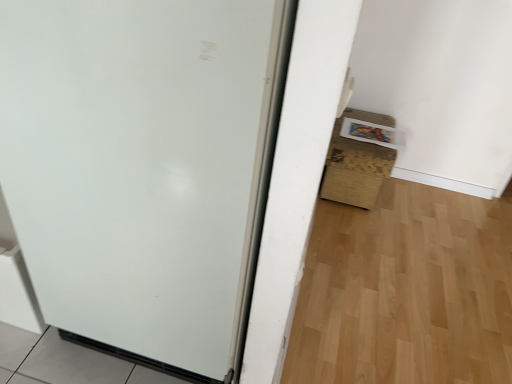
Locate an element on the screen. Image resolution: width=512 pixels, height=384 pixels. white matte door at center is located at coordinates (143, 168).

Describe the element at coordinates (143, 168) in the screenshot. Image resolution: width=512 pixels, height=384 pixels. I see `white matte door at center` at that location.

Image resolution: width=512 pixels, height=384 pixels. Describe the element at coordinates (356, 164) in the screenshot. I see `brown cardboard box at lower right` at that location.

What are the coordinates of `brown cardboard box at lower right` in the screenshot? It's located at (356, 164).

At what (x,y) coordinates should I click in order to perform the action: click on white matte door at center. Please return your answer as a coordinate pair (x, y). The image size is (512, 384). Looking at the image, I should click on (143, 168).

Which object is positioned more to the right, brown cardboard box at lower right or white matte door at center?

brown cardboard box at lower right is more to the right.

Does brown cardboard box at lower right lie behind white matte door at center?

Yes, brown cardboard box at lower right is further from the camera.

Is point (343, 189) less distant than point (156, 117)?

That is False.

From the image's perspective, is brown cardboard box at lower right over white matte door at center?

Yes, from the image's perspective, brown cardboard box at lower right is on top of white matte door at center.

From a real-world perspective, who is located lower, brown cardboard box at lower right or white matte door at center?

brown cardboard box at lower right.

Consider the image. Does brown cardboard box at lower right have a greater width compared to white matte door at center?

No, brown cardboard box at lower right is not wider than white matte door at center.

Does brown cardboard box at lower right have a greater height compared to white matte door at center?

No, brown cardboard box at lower right is not taller than white matte door at center.

Looking at the image, does brown cardboard box at lower right seem bigger or smaller compared to white matte door at center?

Considering their sizes, brown cardboard box at lower right takes up less space than white matte door at center.

From the picture: Can we say brown cardboard box at lower right lies outside white matte door at center?

That's correct, brown cardboard box at lower right is outside of white matte door at center.

Are brown cardboard box at lower right and white matte door at center far apart?

Yes, brown cardboard box at lower right is far from white matte door at center.

Is brown cardboard box at lower right oriented away from white matte door at center?

That's not correct — brown cardboard box at lower right is not looking away from white matte door at center.

Can you tell me how much brown cardboard box at lower right and white matte door at center differ in facing direction?

brown cardboard box at lower right and white matte door at center are facing 90 degrees away from each other.

How far apart are brown cardboard box at lower right and white matte door at center?

A distance of 1.17 meters exists between brown cardboard box at lower right and white matte door at center.

The image size is (512, 384). I want to click on door lying in front of the brown cardboard box at lower right, so click(143, 168).

Based on their positions, is white matte door at center located to the left or right of brown cardboard box at lower right?

white matte door at center is positioned on brown cardboard box at lower right's left side.

Is white matte door at center in front of or behind brown cardboard box at lower right in the image?

Clearly, white matte door at center is in front of brown cardboard box at lower right.

Is point (225, 81) positioned in front of point (382, 123)?

That is True.

From the image's perspective, is white matte door at center on brown cardboard box at lower right?

Actually, white matte door at center appears below brown cardboard box at lower right in the image.

From a real-world perspective, who is located lower, white matte door at center or brown cardboard box at lower right?

In real-world perspective, brown cardboard box at lower right is lower.

Based on the photo, considering the relative sizes of white matte door at center and brown cardboard box at lower right in the image provided, is white matte door at center wider than brown cardboard box at lower right?

Indeed, white matte door at center has a greater width compared to brown cardboard box at lower right.

Can you confirm if white matte door at center is taller than brown cardboard box at lower right?

Indeed, white matte door at center has a greater height compared to brown cardboard box at lower right.

In terms of size, does white matte door at center appear bigger or smaller than brown cardboard box at lower right?

Clearly, white matte door at center is larger in size than brown cardboard box at lower right.

Would you say white matte door at center is inside or outside brown cardboard box at lower right?

white matte door at center is outside brown cardboard box at lower right.

Is the surface of white matte door at center in direct contact with brown cardboard box at lower right?

No, white matte door at center is not in contact with brown cardboard box at lower right.

Is white matte door at center turned away from brown cardboard box at lower right?

No, white matte door at center is not facing the opposite direction of brown cardboard box at lower right.

Measure the distance between white matte door at center and brown cardboard box at lower right.

white matte door at center is 3.83 feet from brown cardboard box at lower right.

Locate an element on the screen. Image resolution: width=512 pixels, height=384 pixels. cardboard box that is on the right side of white matte door at center is located at coordinates (356, 164).

This screenshot has width=512, height=384. I want to click on door above the brown cardboard box at lower right (from a real-world perspective), so click(143, 168).

At what (x,y) coordinates should I click in order to perform the action: click on door in front of the brown cardboard box at lower right. Please return your answer as a coordinate pair (x, y). This screenshot has width=512, height=384. Looking at the image, I should click on (143, 168).